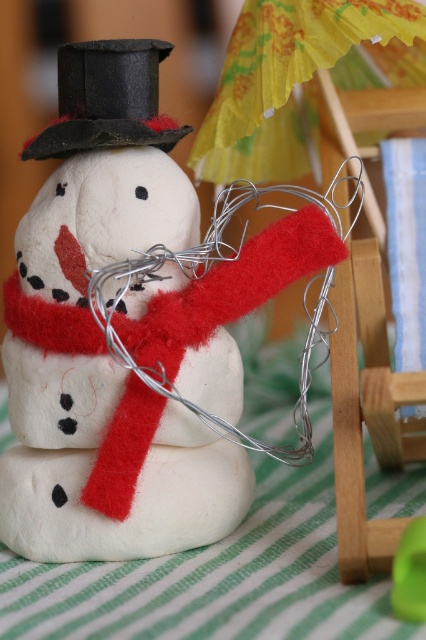
Question: Can you confirm if felt white snowman at center is positioned above green striped fabric at lower center?

Choices:
 (A) yes
 (B) no

Answer: (A)

Question: Is felt white snowman at center to the left of green striped fabric at lower center from the viewer's perspective?

Choices:
 (A) yes
 (B) no

Answer: (A)

Question: Is felt white snowman at center positioned in front of black felt hat at upper center?

Choices:
 (A) yes
 (B) no

Answer: (B)

Question: Which object is the closest to the felt white snowman at center?

Choices:
 (A) green striped fabric at lower center
 (B) black felt hat at upper center

Answer: (B)

Question: Among these objects, which one is farthest from the camera?

Choices:
 (A) green striped fabric at lower center
 (B) black felt hat at upper center
 (C) felt white snowman at center

Answer: (C)

Question: Among these points, which one is farthest from the camera?

Choices:
 (A) (149, 61)
 (B) (57, 616)

Answer: (A)